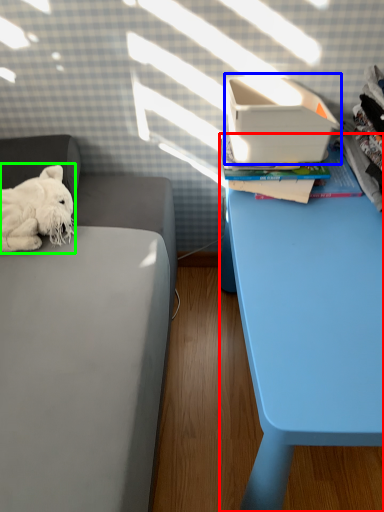
Question: Which object is the farthest from table (highlighted by a red box)? Choose among these: shoe box (highlighted by a blue box) or dog (highlighted by a green box).

Choices:
 (A) shoe box
 (B) dog

Answer: (B)